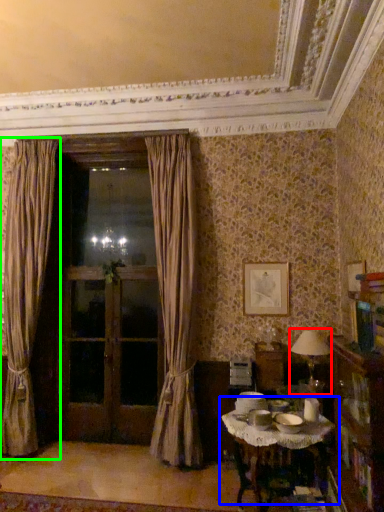
Question: Based on their relative distances, which object is farther from table lamp (highlighted by a red box)? Choose from table (highlighted by a blue box) and curtain (highlighted by a green box).

Choices:
 (A) table
 (B) curtain

Answer: (B)